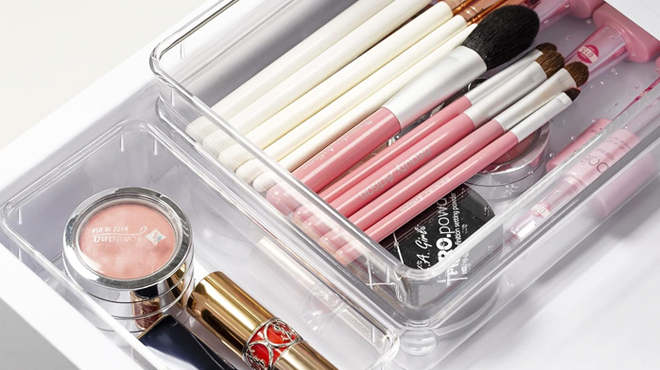
Locate an element on the screen. makeup applicator brushes is located at coordinates (261, 81), (280, 95), (300, 108), (315, 120), (331, 132), (356, 139), (380, 157), (391, 169), (412, 180), (430, 196).